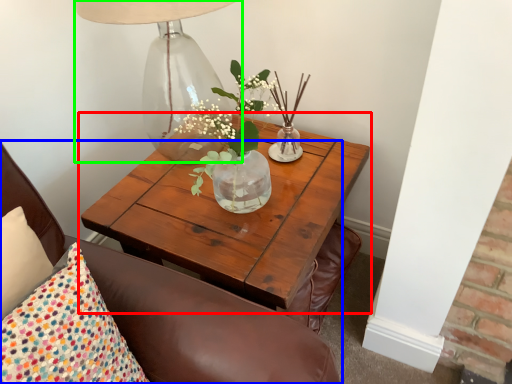
Question: Considering the real-world distances, which object is farthest from coffee table (highlighted by a red box)? chair (highlighted by a blue box) or table lamp (highlighted by a green box)?

Choices:
 (A) chair
 (B) table lamp

Answer: (B)